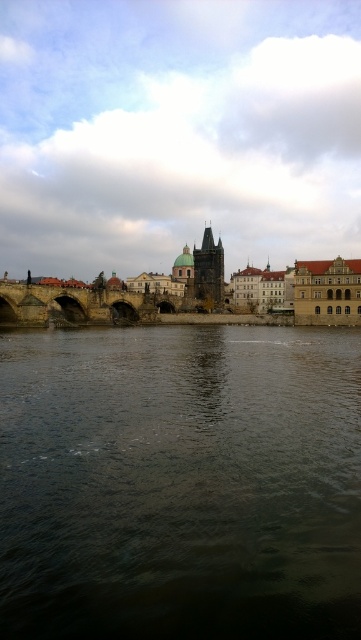
Question: Is dark brown water at center to the right of stone bridge at center from the viewer's perspective?

Choices:
 (A) yes
 (B) no

Answer: (A)

Question: Can you confirm if dark brown water at center is bigger than stone bridge at center?

Choices:
 (A) yes
 (B) no

Answer: (A)

Question: Which object appears farthest from the camera in this image?

Choices:
 (A) stone bridge at center
 (B) dark brown water at center

Answer: (A)

Question: Does dark brown water at center have a lesser width compared to stone bridge at center?

Choices:
 (A) yes
 (B) no

Answer: (B)

Question: Which of the following is the farthest from the observer?

Choices:
 (A) dark brown water at center
 (B) stone bridge at center

Answer: (B)